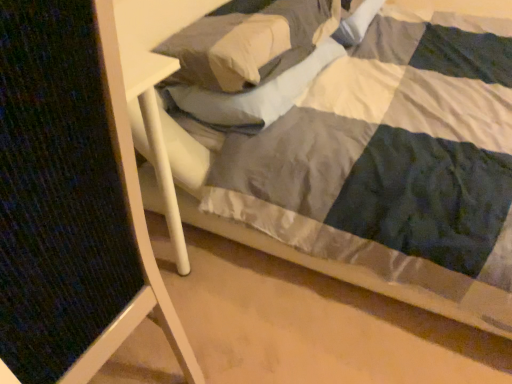
Image resolution: width=512 pixels, height=384 pixels. Describe the element at coordinates (249, 44) in the screenshot. I see `soft white pillow at upper center` at that location.

Where is `soft white pillow at upper center`? soft white pillow at upper center is located at coordinates pos(249,44).

The width and height of the screenshot is (512, 384). In order to click on textured fabric folding chair at left in this screenshot , I will do `click(70, 199)`.

This screenshot has height=384, width=512. What do you see at coordinates (70, 199) in the screenshot?
I see `textured fabric folding chair at left` at bounding box center [70, 199].

The width and height of the screenshot is (512, 384). What are the coordinates of `soft white pillow at upper center` in the screenshot? It's located at [x=249, y=44].

Is textured fabric folding chair at left to the left of soft white pillow at upper center from the viewer's perspective?

Answer: Indeed, textured fabric folding chair at left is positioned on the left side of soft white pillow at upper center.

Is textured fabric folding chair at left positioned before soft white pillow at upper center?

Yes, textured fabric folding chair at left is closer to the camera.

Which is behind, point (56, 349) or point (220, 90)?

Point (220, 90)

From the image's perspective, which one is positioned lower, textured fabric folding chair at left or soft white pillow at upper center?

textured fabric folding chair at left.

From a real-world perspective, is textured fabric folding chair at left physically below soft white pillow at upper center?

Yes, from a real-world perspective, textured fabric folding chair at left is under soft white pillow at upper center.

Is textured fabric folding chair at left wider or thinner than soft white pillow at upper center?

In the image, textured fabric folding chair at left appears to be more narrow than soft white pillow at upper center.

Considering the sizes of objects textured fabric folding chair at left and soft white pillow at upper center in the image provided, who is shorter, textured fabric folding chair at left or soft white pillow at upper center?

With less height is soft white pillow at upper center.

Based on their sizes in the image, would you say textured fabric folding chair at left is bigger or smaller than soft white pillow at upper center?

Clearly, textured fabric folding chair at left is larger in size than soft white pillow at upper center.

Is textured fabric folding chair at left situated inside soft white pillow at upper center or outside?

textured fabric folding chair at left is not inside soft white pillow at upper center, it's outside.

Are textured fabric folding chair at left and soft white pillow at upper center beside each other?

No, textured fabric folding chair at left is not with soft white pillow at upper center.

Is textured fabric folding chair at left looking in the opposite direction of soft white pillow at upper center?

textured fabric folding chair at left does not have its back to soft white pillow at upper center.

Measure the distance from textured fabric folding chair at left to soft white pillow at upper center.

textured fabric folding chair at left and soft white pillow at upper center are 31.43 inches apart from each other.

You are a GUI agent. You are given a task and a screenshot of the screen. Output one action in this format:
    pyautogui.click(x=<x>, y=<y>)
    Task: Click on the pillow located above the textured fabric folding chair at left (from the image's perspective)
    The image size is (512, 384).
    Given the screenshot: What is the action you would take?
    pyautogui.click(x=249, y=44)

Which object is positioned more to the left, soft white pillow at upper center or textured fabric folding chair at left?

textured fabric folding chair at left.

Looking at this image, does soft white pillow at upper center lie behind textured fabric folding chair at left?

Yes, it is behind textured fabric folding chair at left.

Does point (302, 10) lie in front of point (3, 88)?

No, (302, 10) is further to viewer.

From the image's perspective, is soft white pillow at upper center beneath textured fabric folding chair at left?

No, from the image's perspective, soft white pillow at upper center is not below textured fabric folding chair at left.

From a real-world perspective, does soft white pillow at upper center sit lower than textured fabric folding chair at left?

No, from a real-world perspective, soft white pillow at upper center is not below textured fabric folding chair at left.

Considering the sizes of soft white pillow at upper center and textured fabric folding chair at left in the image, is soft white pillow at upper center wider or thinner than textured fabric folding chair at left?

In the image, soft white pillow at upper center appears to be wider than textured fabric folding chair at left.

Considering the sizes of objects soft white pillow at upper center and textured fabric folding chair at left in the image provided, who is shorter, soft white pillow at upper center or textured fabric folding chair at left?

soft white pillow at upper center.

Considering the relative sizes of soft white pillow at upper center and textured fabric folding chair at left in the image provided, is soft white pillow at upper center smaller than textured fabric folding chair at left?

Yes.

Would you say soft white pillow at upper center is outside textured fabric folding chair at left?

Yes, soft white pillow at upper center is outside of textured fabric folding chair at left.

Is soft white pillow at upper center far away from textured fabric folding chair at left?

No.

Is soft white pillow at upper center facing away from textured fabric folding chair at left?

No, soft white pillow at upper center's orientation is not away from textured fabric folding chair at left.

The width and height of the screenshot is (512, 384). In order to click on pillow on the right of textured fabric folding chair at left in this screenshot , I will do `click(249, 44)`.

Identify the location of pillow above the textured fabric folding chair at left (from the image's perspective). (249, 44).

Image resolution: width=512 pixels, height=384 pixels. There is a textured fabric folding chair at left. What are the coordinates of `pillow above it (from a real-world perspective)` in the screenshot? It's located at (249, 44).